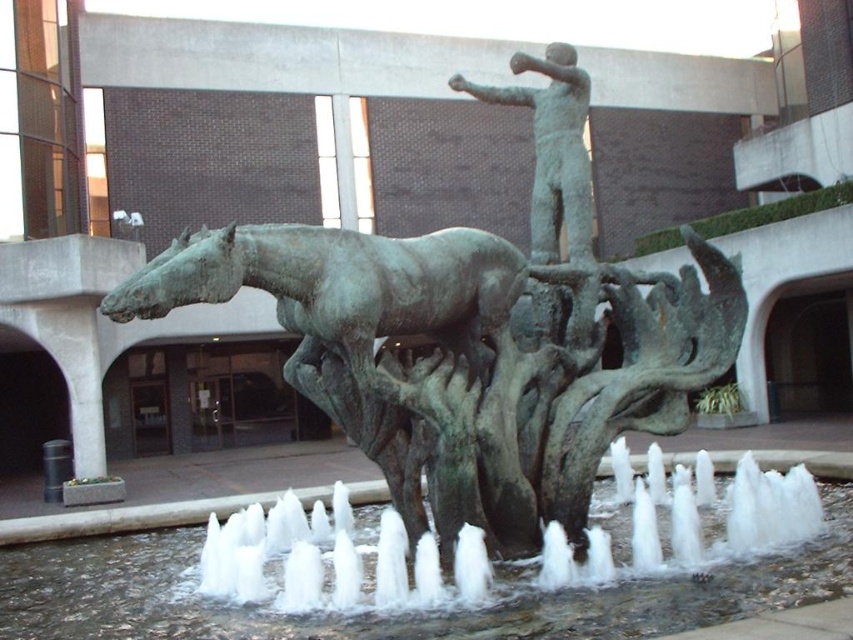
Question: Which is farther from the bronze statue at center?

Choices:
 (A) bronze figure at center
 (B) bronze horse at center

Answer: (A)

Question: Which object is the closest to the clear water at fountain center?

Choices:
 (A) bronze horse at center
 (B) bronze statue at center

Answer: (B)

Question: Is bronze statue at center wider than bronze horse at center?

Choices:
 (A) no
 (B) yes

Answer: (A)

Question: Observing the image, what is the correct spatial positioning of bronze statue at center in reference to bronze figure at center?

Choices:
 (A) above
 (B) below

Answer: (B)

Question: Which point is farther to the camera?

Choices:
 (A) bronze figure at center
 (B) bronze statue at center
 (C) clear water at fountain center
 (D) bronze horse at center

Answer: (A)

Question: Is clear water at fountain center smaller than bronze horse at center?

Choices:
 (A) yes
 (B) no

Answer: (B)